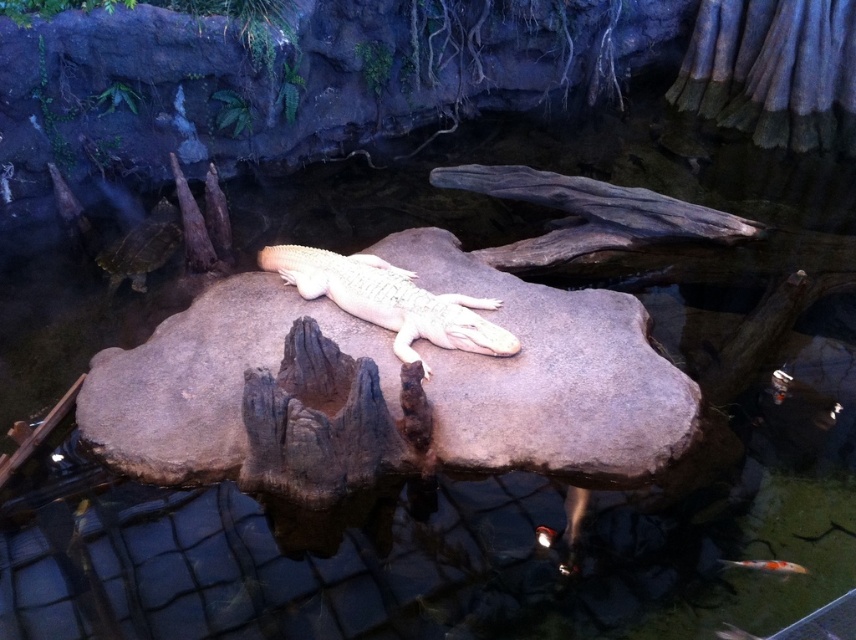
Can you confirm if smooth gray rock at center is shorter than smooth cream-colored crocodile at center?

No, smooth gray rock at center is not shorter than smooth cream-colored crocodile at center.

Does smooth gray rock at center appear over smooth cream-colored crocodile at center?

No, smooth gray rock at center is not above smooth cream-colored crocodile at center.

Is point (634, 456) closer to camera compared to point (298, 268)?

That is True.

Identify the location of smooth gray rock at center. The width and height of the screenshot is (856, 640). (550, 378).